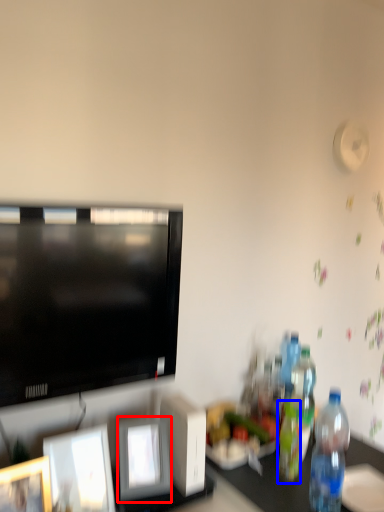
Question: Which of the following is the closest to the observer, picture frame (highlighted by a red box) or bottle (highlighted by a blue box)?

Choices:
 (A) picture frame
 (B) bottle

Answer: (A)